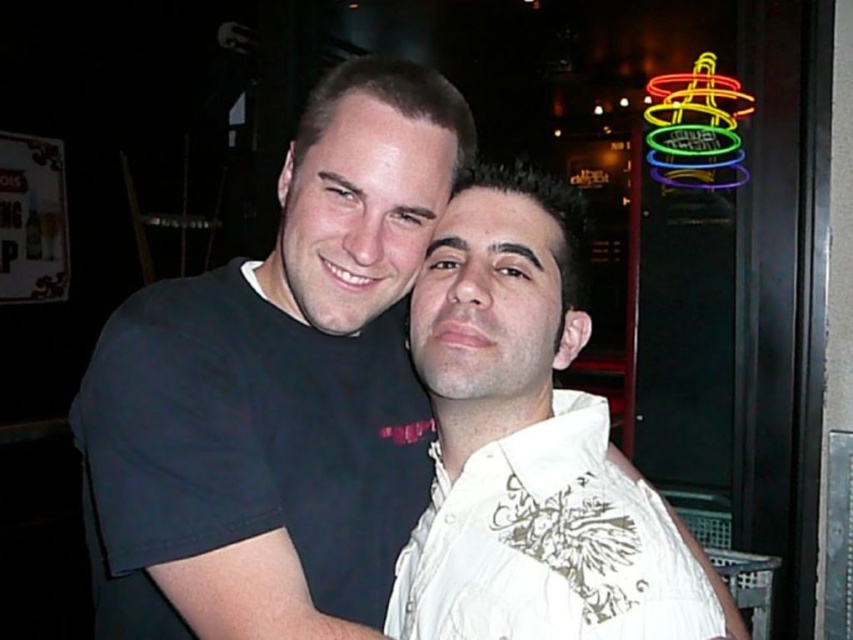
Can you confirm if black matte t-shirt at center is taller than neon sign at upper right?

Yes.

Is black matte t-shirt at center thinner than neon sign at upper right?

No, black matte t-shirt at center is not thinner than neon sign at upper right.

Between point (135, 356) and point (689, 115), which one is positioned in front?

Point (135, 356) is in front.

Locate an element on the screen. black matte t-shirt at center is located at coordinates (277, 390).

Which is in front, point (546, 428) or point (698, 132)?

Point (546, 428)

Does white embroidered shirt at center appear under neon sign at upper right?

Yes, white embroidered shirt at center is below neon sign at upper right.

Is point (445, 516) farther from viewer compared to point (680, 140)?

That is False.

Identify the location of white embroidered shirt at center. Image resolution: width=853 pixels, height=640 pixels. (548, 545).

Which is more to the right, black matte t-shirt at center or white textured shirt at center?

Answer: white textured shirt at center

Measure the distance between black matte t-shirt at center and white textured shirt at center.

black matte t-shirt at center and white textured shirt at center are 15.82 centimeters apart from each other.

Identify the location of black matte t-shirt at center. pyautogui.click(x=277, y=390).

Image resolution: width=853 pixels, height=640 pixels. What are the coordinates of `black matte t-shirt at center` in the screenshot? It's located at (277, 390).